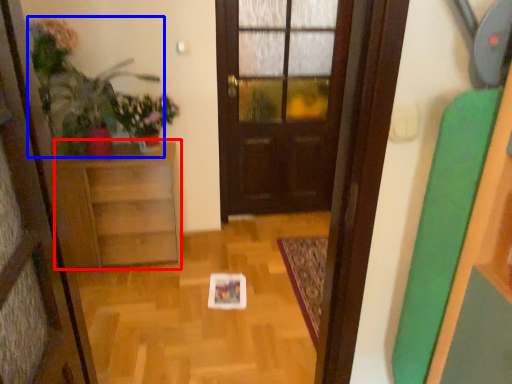
Question: Which of the following is the closest to the observer, furniture (highlighted by a red box) or plant (highlighted by a blue box)?

Choices:
 (A) furniture
 (B) plant

Answer: (B)